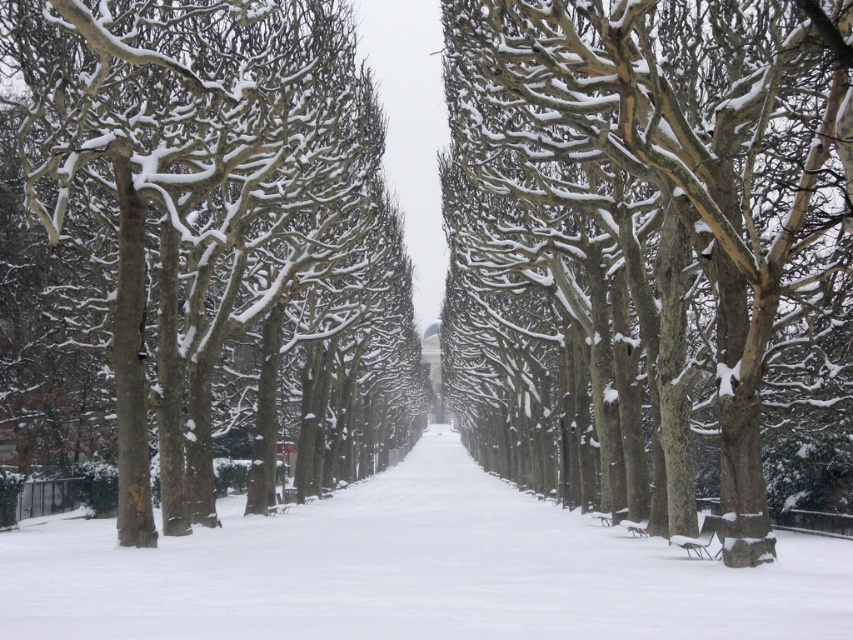
Between white snow-covered pavement at center and wooden park bench at center, which one has more height?

white snow-covered pavement at center is taller.

What do you see at coordinates (410, 570) in the screenshot? Image resolution: width=853 pixels, height=640 pixels. I see `white snow-covered pavement at center` at bounding box center [410, 570].

This screenshot has height=640, width=853. What are the coordinates of `white snow-covered pavement at center` in the screenshot? It's located at (410, 570).

Based on the photo, which is above, snow-covered bark trees at center or smooth bark trees at center?

smooth bark trees at center is above.

Is point (450, 268) less distant than point (288, 378)?

No, it is not.

You are a GUI agent. You are given a task and a screenshot of the screen. Output one action in this format:
    pyautogui.click(x=<x>, y=<y>)
    Task: Click on the snow-covered bark trees at center
    The image size is (853, 640).
    Given the screenshot: What is the action you would take?
    pyautogui.click(x=647, y=240)

Which is more to the right, snow-covered bark trees at center or wooden park bench at center?

Positioned to the right is wooden park bench at center.

Does snow-covered bark trees at center appear over wooden park bench at center?

Yes.

Is point (782, 241) less distant than point (688, 552)?

Yes, point (782, 241) is in front of point (688, 552).

Identify the location of snow-covered bark trees at center. The image size is (853, 640). (647, 240).